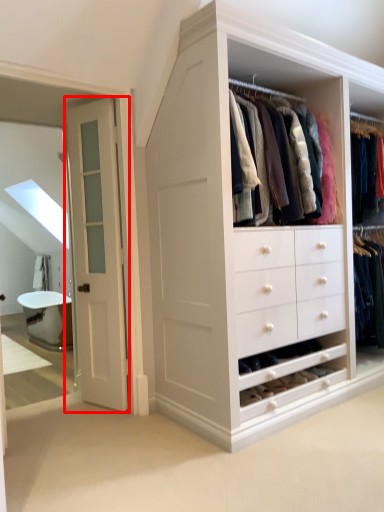
Question: In this image, where is door (annotated by the red box) located relative to bath?

Choices:
 (A) right
 (B) left

Answer: (A)